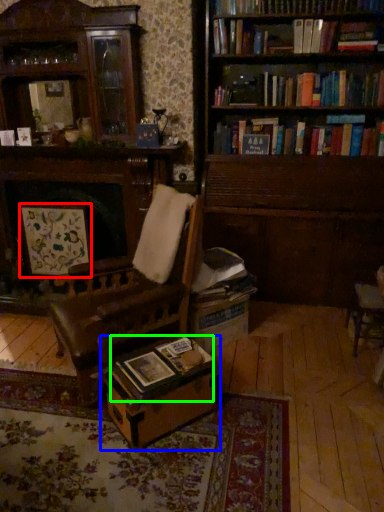
Question: Considering the real-world distances, which object is closest to picture frame (highlighted by a red box)? table (highlighted by a blue box) or book (highlighted by a green box).

Choices:
 (A) table
 (B) book

Answer: (B)